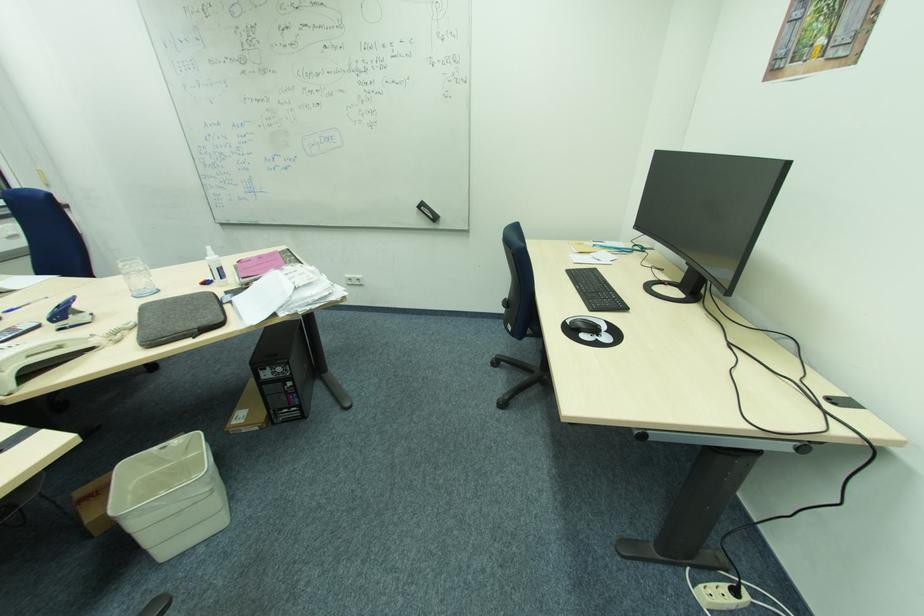
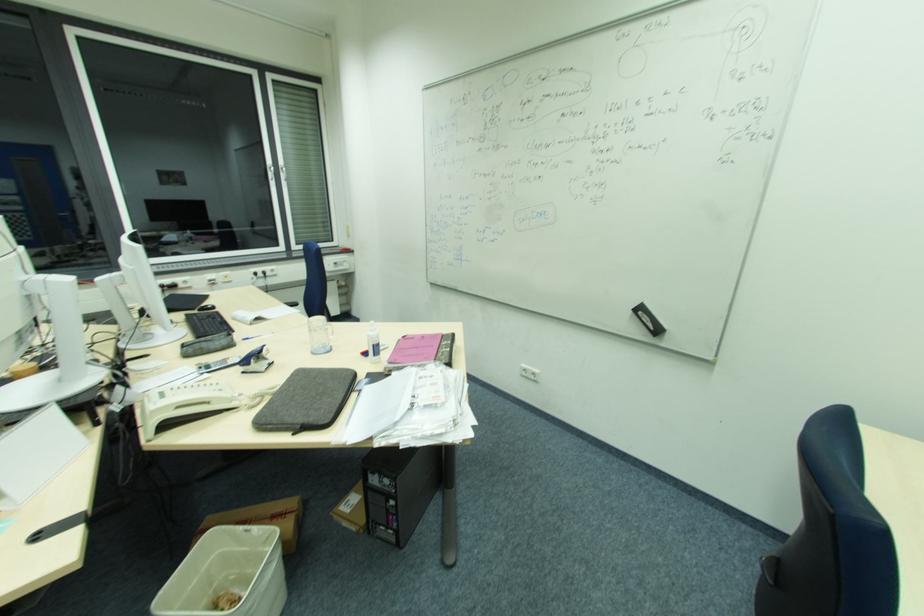
In the second image, find the point that corresponds to point (426, 208) in the first image.

(643, 314)